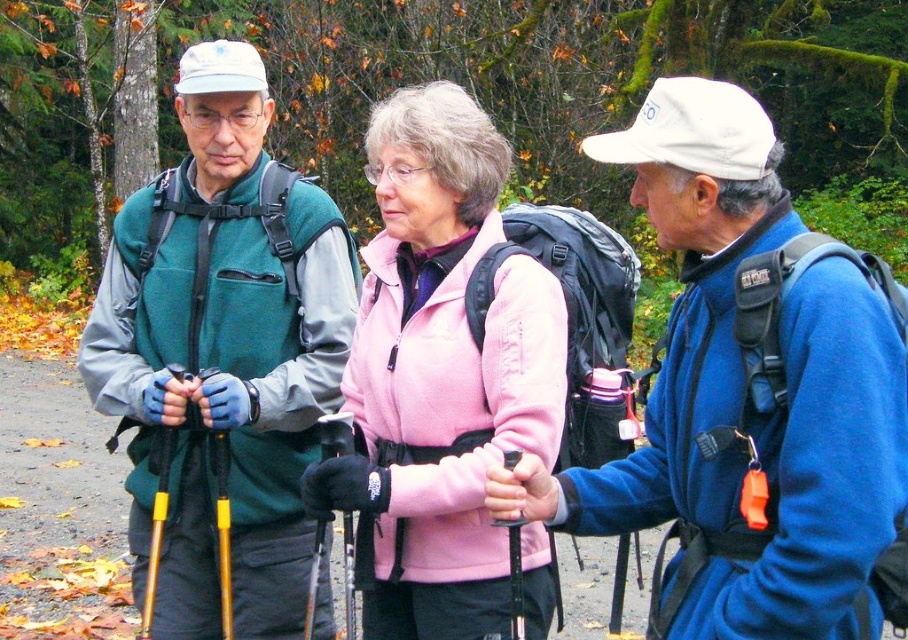
Does blue fleece jacket at center appear on the right side of matte green vest at left?

Yes, blue fleece jacket at center is to the right of matte green vest at left.

Which of these two, blue fleece jacket at center or matte green vest at left, stands taller?

matte green vest at left is taller.

This screenshot has width=908, height=640. Identify the location of blue fleece jacket at center. (749, 397).

Who is shorter, blue fleece jacket at center or pink fleece jacket at center?

Standing shorter between the two is blue fleece jacket at center.

At what (x,y) coordinates should I click in order to perform the action: click on blue fleece jacket at center. Please return your answer as a coordinate pair (x, y). Looking at the image, I should click on (749, 397).

Is point (717, 355) positioned before point (481, 195)?

Yes, it is in front of point (481, 195).

At what (x,y) coordinates should I click in order to perform the action: click on blue fleece jacket at center. Please return your answer as a coordinate pair (x, y). Looking at the image, I should click on (749, 397).

Between matte green vest at left and pink fleece jacket at center, which one has less height?

Standing shorter between the two is pink fleece jacket at center.

Does point (278, 416) lie in front of point (499, 216)?

No.

Where is `matte green vest at left`? The width and height of the screenshot is (908, 640). matte green vest at left is located at coordinates (223, 352).